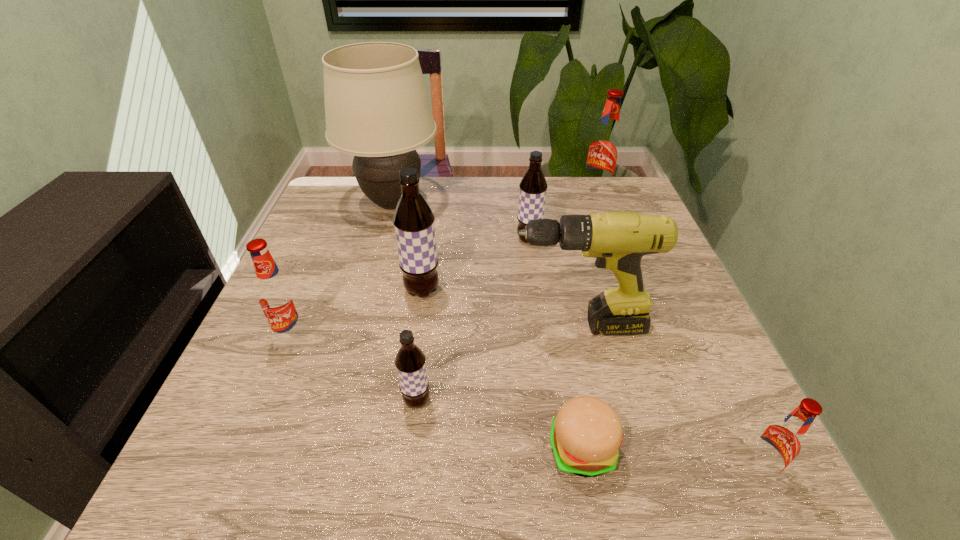
Where is `free location located on the handle side of the drill`? free location located on the handle side of the drill is located at coordinates (396, 326).

At what (x,y) coordinates should I click in order to perform the action: click on free space located on the handle side of the drill. Please return your answer as a coordinate pair (x, y). The image size is (960, 540). Looking at the image, I should click on 376,326.

I want to click on free region located 0.250m on the back of the second farthest red root beer, so click(329, 250).

Where is `free region located 0.300m on the front of the second biggest brown root beer`? This screenshot has height=540, width=960. free region located 0.300m on the front of the second biggest brown root beer is located at coordinates (542, 339).

Image resolution: width=960 pixels, height=540 pixels. Find the location of `vacant area located 0.290m on the left of the seventh farthest object`. vacant area located 0.290m on the left of the seventh farthest object is located at coordinates (240, 401).

At what (x,y) coordinates should I click in order to perform the action: click on vacant region located 0.070m on the left of the rightmost root beer. Please return your answer as a coordinate pair (x, y). The image size is (960, 540). Looking at the image, I should click on (698, 469).

Where is `vacant region located on the back of the beige hamburger`? The height and width of the screenshot is (540, 960). vacant region located on the back of the beige hamburger is located at coordinates (572, 395).

You are a GUI agent. You are given a task and a screenshot of the screen. Output one action in this format:
    pyautogui.click(x=<x>, y=<y>)
    Task: Click on the lampshade at the far edge
    This screenshot has height=540, width=960.
    Given the screenshot: What is the action you would take?
    pyautogui.click(x=377, y=108)

Where is `root beer at the far edge`? The width and height of the screenshot is (960, 540). root beer at the far edge is located at coordinates (x=604, y=148).

This screenshot has height=540, width=960. I want to click on root beer that is at the near edge, so 780,442.